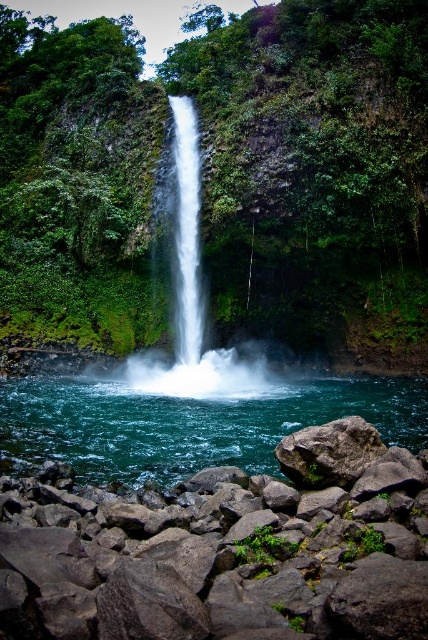
Which is above, green leafy vegetation at center or clear blue water at center?

Positioned higher is green leafy vegetation at center.

What do you see at coordinates (222, 173) in the screenshot?
I see `green leafy vegetation at center` at bounding box center [222, 173].

Find the location of a particular element. This screenshot has height=640, width=428. green leafy vegetation at center is located at coordinates (222, 173).

Which is more to the right, clear blue water at center or white smooth waterfall at center?

clear blue water at center

The image size is (428, 640). What do you see at coordinates (193, 420) in the screenshot? I see `clear blue water at center` at bounding box center [193, 420].

Does point (258, 461) lie behind point (195, 115)?

No, (258, 461) is in front of (195, 115).

The height and width of the screenshot is (640, 428). What are the coordinates of `clear blue water at center` in the screenshot? It's located at (193, 420).

Between green leafy vegetation at center and smooth gray rock at lower left, which one has more height?

green leafy vegetation at center is taller.

Based on the photo, is green leafy vegetation at center to the right of smooth gray rock at lower left from the viewer's perspective?

Incorrect, green leafy vegetation at center is not on the right side of smooth gray rock at lower left.

What are the coordinates of `green leafy vegetation at center` in the screenshot? It's located at (222, 173).